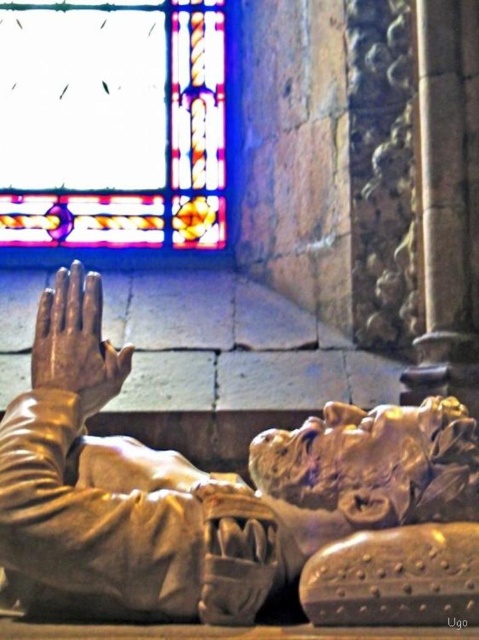
Based on the photo, you are an art conservator examining the gold polished statue at center and the gold metallic hand at center. Which object is located to the right of the other?

The gold polished statue at center is positioned on the right side of gold metallic hand at center.

You are an art conservator examining the gold polished statue at center and the stained glass window at upper left. Based on their positions, which object is closer to the right edge of the image?

The gold polished statue at center is positioned on the right side of the stained glass window at upper left, meaning it is closer to the right edge of the image.